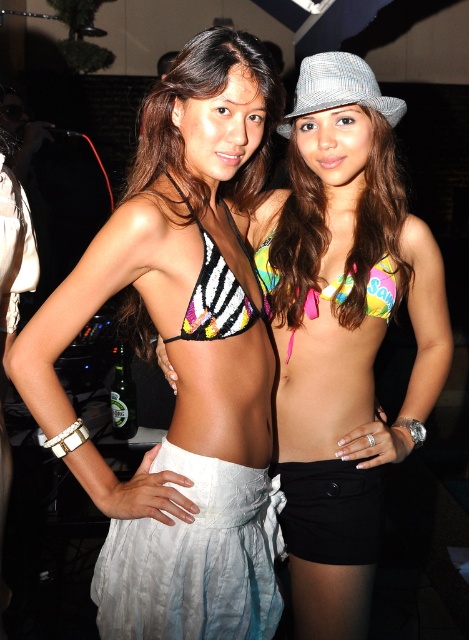
Question: Is the position of zebra-patterned sequined bikini top at center more distant than that of neon tie-dye bikini top at center?

Choices:
 (A) no
 (B) yes

Answer: (A)

Question: Is black matte shorts at lower center thinner than neon tie-dye bikini top at center?

Choices:
 (A) yes
 (B) no

Answer: (A)

Question: Which object is the farthest from the white fabric skirt at lower left?

Choices:
 (A) neon tie-dye bikini top at center
 (B) zebra-patterned sequined bikini top at center
 (C) matte black bikini top at center
 (D) black matte shorts at lower center

Answer: (C)

Question: Can you confirm if multicolored sequined bikini top at center is positioned below matte black bikini top at center?

Choices:
 (A) no
 (B) yes

Answer: (B)

Question: Which of the following is the farthest from the observer?

Choices:
 (A) (240, 308)
 (B) (357, 483)

Answer: (B)

Question: Estimate the real-world distances between objects in this image. Which object is closer to the multicolored sequined bikini top at center?

Choices:
 (A) multicolored bikini top at center
 (B) black matte shorts at lower center
 (C) matte black bikini top at center
 (D) white fabric skirt at lower left

Answer: (B)